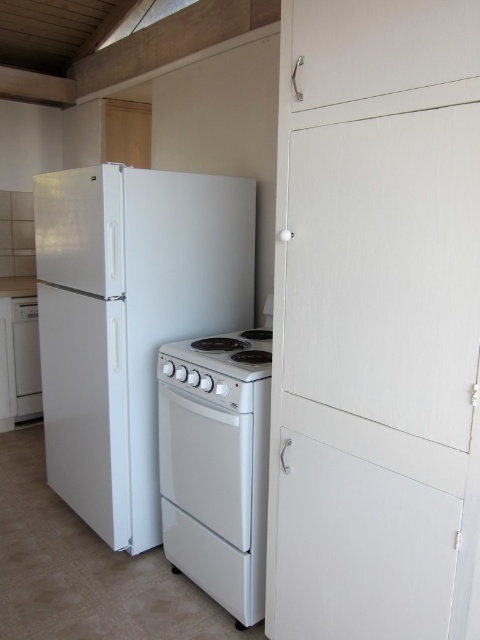
What object is located at the coordinates point (x=129, y=321) in the kitchen scene?

The white matte refrigerator at left is located at point (x=129, y=321).

You are organizing the kitchen and need to move the white matte refrigerator at left and the white glossy dishwasher at left. Which appliance requires more space to move due to its size?

The white matte refrigerator at left requires more space to move because it is bigger than the white glossy dishwasher at left.